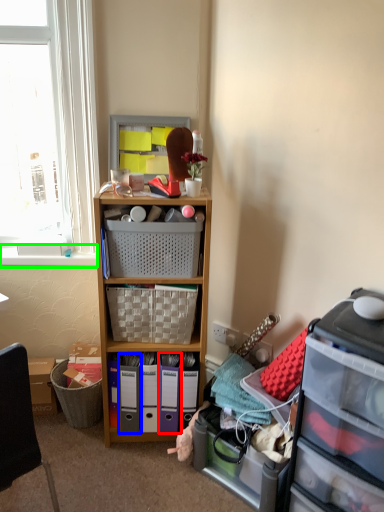
Question: Which object is the farthest from bin (highlighted by a red box)? Choose among these: bin (highlighted by a blue box) or window sill (highlighted by a green box).

Choices:
 (A) bin
 (B) window sill

Answer: (B)